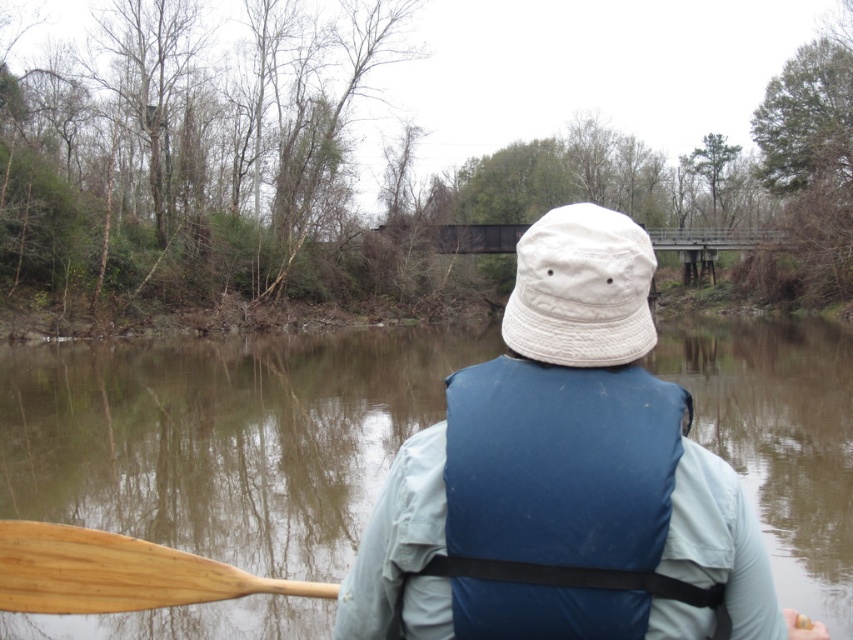
Which is above, brown smooth water at center or wooden paddle at lower left?

brown smooth water at center is higher up.

Can you confirm if brown smooth water at center is positioned below wooden paddle at lower left?

No, brown smooth water at center is not below wooden paddle at lower left.

Who is more forward, (311, 637) or (86, 544)?

Point (86, 544) is more forward.

Find the location of a particular element. This screenshot has height=640, width=853. brown smooth water at center is located at coordinates (224, 436).

Does white fabric hat at upper center come behind blue fabric life jacket at center?

Yes, white fabric hat at upper center is further from the viewer.

Does white fabric hat at upper center appear on the left side of blue fabric life jacket at center?

Indeed, white fabric hat at upper center is positioned on the left side of blue fabric life jacket at center.

Describe the element at coordinates (564, 477) in the screenshot. The image size is (853, 640). I see `white fabric hat at upper center` at that location.

Where is `white fabric hat at upper center`? The image size is (853, 640). white fabric hat at upper center is located at coordinates (564, 477).

Which is more to the left, brown smooth water at center or white fabric hat at upper center?

From the viewer's perspective, brown smooth water at center appears more on the left side.

Image resolution: width=853 pixels, height=640 pixels. I want to click on brown smooth water at center, so coord(224,436).